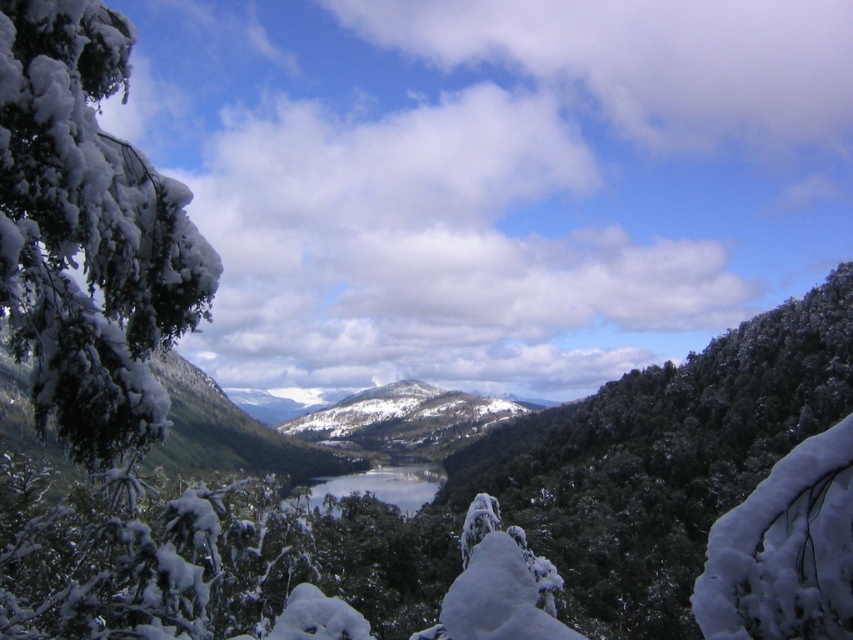
Question: Which object is the farthest from the white snow-covered mountain at center?

Choices:
 (A) white snow-covered branch at left
 (B) clear blue water at center

Answer: (A)

Question: Is white snow-covered mountain at center thinner than clear blue water at center?

Choices:
 (A) no
 (B) yes

Answer: (A)

Question: Among these points, which one is nearest to the camera?

Choices:
 (A) (380, 394)
 (B) (186, 204)
 (C) (376, 480)

Answer: (B)

Question: Is white snow-covered mountain at center to the left of clear blue water at center from the viewer's perspective?

Choices:
 (A) yes
 (B) no

Answer: (A)

Question: Among these objects, which one is nearest to the camera?

Choices:
 (A) clear blue water at center
 (B) white snow-covered branch at left

Answer: (B)

Question: Is white snow-covered mountain at center further to the viewer compared to clear blue water at center?

Choices:
 (A) no
 (B) yes

Answer: (B)